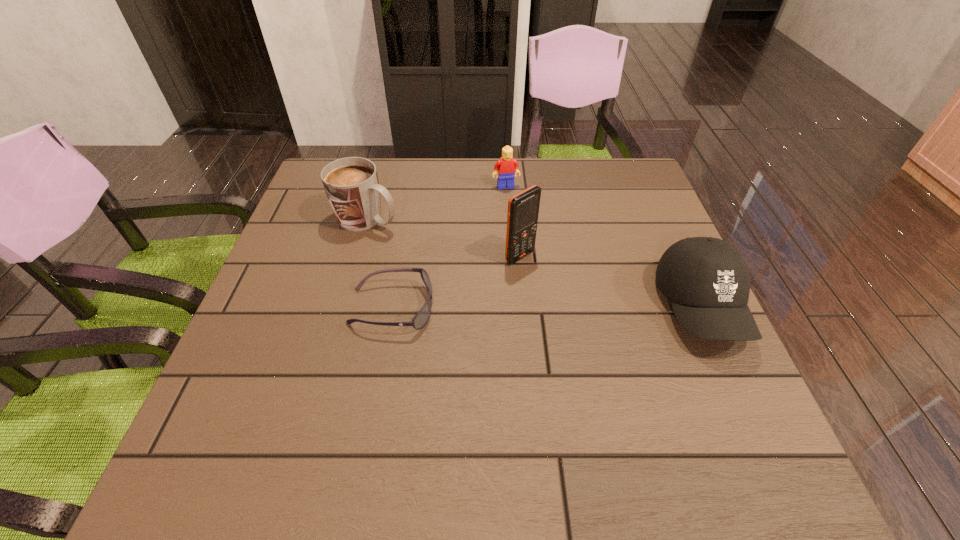
Where is `the shortest object`? The width and height of the screenshot is (960, 540). the shortest object is located at coordinates (422, 317).

This screenshot has width=960, height=540. Find the location of `baseball cap`. baseball cap is located at coordinates (707, 280).

The height and width of the screenshot is (540, 960). In order to click on the second farthest object in this screenshot , I will do `click(351, 184)`.

This screenshot has width=960, height=540. What are the coordinates of `cellular telephone` in the screenshot? It's located at (523, 208).

Locate an element on the screen. the farthest object is located at coordinates (507, 167).

Identify the location of vacant space located on the lenses of the shortest object. Image resolution: width=960 pixels, height=540 pixels. (466, 308).

This screenshot has height=540, width=960. Find the location of `vacant region located on the front-facing side of the rightmost object`. vacant region located on the front-facing side of the rightmost object is located at coordinates pyautogui.click(x=751, y=416).

The height and width of the screenshot is (540, 960). In order to click on vacant space positioned 0.150m on the side of the fourth nearest object with the handle in this screenshot , I will do `click(444, 247)`.

I want to click on vacant region located on the side of the fourth nearest object with the handle, so click(509, 275).

Locate an element on the screen. free location located 0.080m on the side of the fourth nearest object with the handle is located at coordinates pos(420,238).